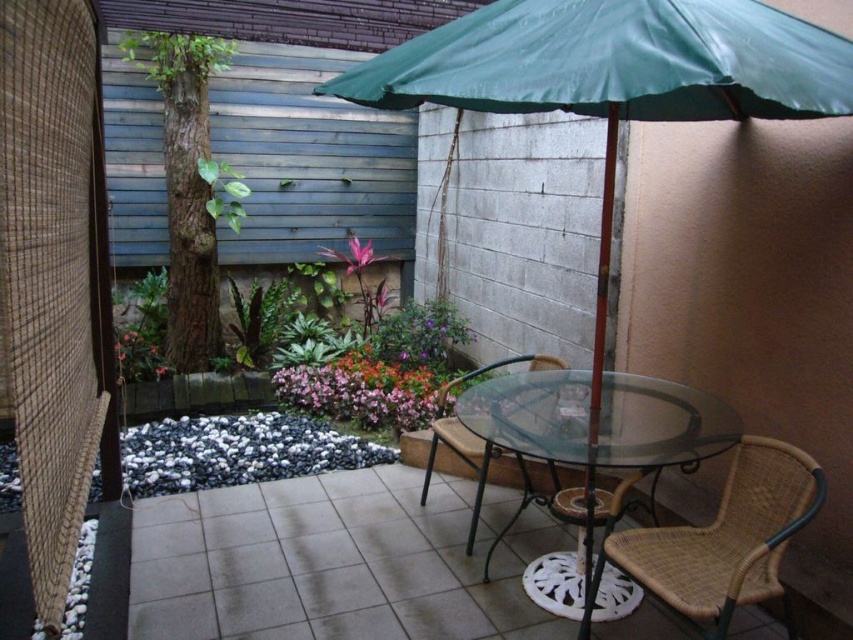
You are standing at the entrance of the patio and want to locate the green fabric umbrella at center. According to the coordinates provided, where should you look? Please provide the coordinates in the format of a point like point (614, 74).

The green fabric umbrella at center is marked by point (614, 74).

You are planning to place a small statue between the purple matte plant at center and the green glossy leaf at center. Which object should the statue be closer to if it needs to be placed at the same height as the taller object?

The green glossy leaf at center is taller than the purple matte plant at center. Therefore, the statue should be placed closer to the green glossy leaf at center to match its height.